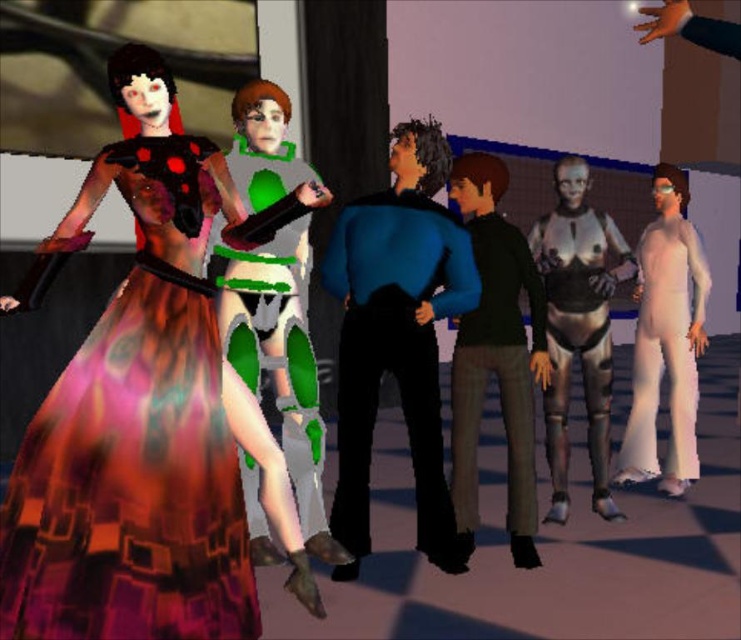
Question: Which object is positioned closest to the metallic silver suit at center?

Choices:
 (A) white matte jumpsuit at right
 (B) black matte pants at center
 (C) blue matte shirt at center

Answer: (B)

Question: Is green matte armor at center above white matte jumpsuit at right?

Choices:
 (A) no
 (B) yes

Answer: (A)

Question: Can you confirm if blue matte shirt at center is thinner than metallic silver suit at center?

Choices:
 (A) yes
 (B) no

Answer: (A)

Question: Which of the following is the closest to the observer?

Choices:
 (A) multicolored fabric dress at left
 (B) white matte jumpsuit at right
 (C) green matte armor at center
 (D) metallic silver suit at center

Answer: (A)

Question: Is multicolored fabric dress at left in front of black matte pants at center?

Choices:
 (A) no
 (B) yes

Answer: (B)

Question: Which of the following is the closest to the observer?

Choices:
 (A) green matte armor at center
 (B) metallic silver suit at center

Answer: (A)